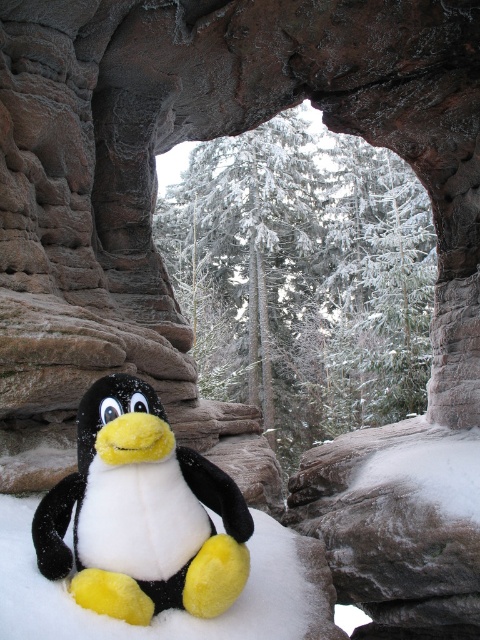
You are standing at the point with coordinates (143,513) in the image. Which object are you on?

You are on the black plush penguin at center because the point (143,513) is located on it.

You are a photographer trying to capture the black plush penguin at center and the white fluffy snow at center in a single shot. Since the snow is covering most of the ground, will the penguin be easily visible in the photo?

The black plush penguin at center has a smaller size compared to white fluffy snow at center, so the penguin might be harder to spot against the snow in the photo.